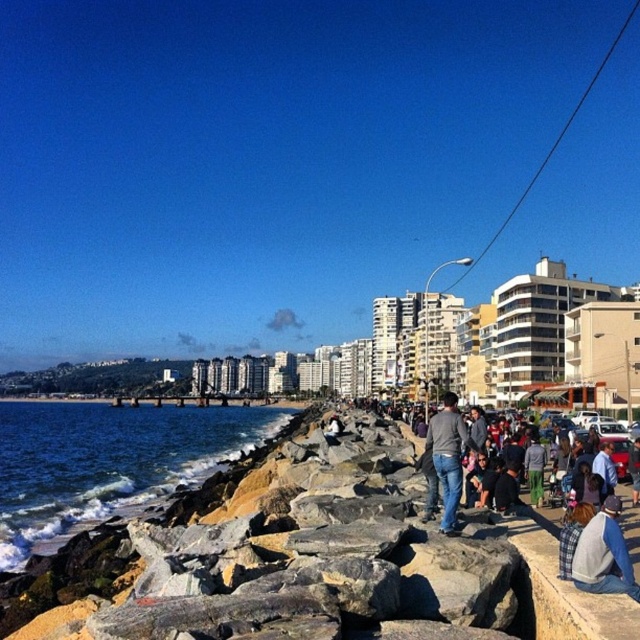
Where is `plaid fabric jacket at lower right`? The height and width of the screenshot is (640, 640). plaid fabric jacket at lower right is located at coordinates (604, 554).

In the scene shown: Is plaid fabric jacket at lower right positioned at the back of jeans at center?

No, it is not.

Does point (625, 576) lie in front of point (438, 468)?

Yes, it is.

Identify the location of plaid fabric jacket at lower right. This screenshot has height=640, width=640. (604, 554).

Does blue smooth water at lower left have a lesser height compared to jeans at center?

Incorrect, blue smooth water at lower left's height does not fall short of jeans at center's.

Between blue smooth water at lower left and jeans at center, which one appears on the left side from the viewer's perspective?

Positioned to the left is blue smooth water at lower left.

Does point (44, 452) come in front of point (458, 444)?

No.

You are a GUI agent. You are given a task and a screenshot of the screen. Output one action in this format:
    pyautogui.click(x=<x>, y=<y>)
    Task: Click on the blue smooth water at lower left
    The height and width of the screenshot is (640, 640).
    Given the screenshot: What is the action you would take?
    pyautogui.click(x=108, y=461)

Does blue smooth water at lower left have a larger size compared to denim jacket at lower right?

Correct, blue smooth water at lower left is larger in size than denim jacket at lower right.

Does point (44, 464) come closer to viewer compared to point (627, 464)?

No, it is behind (627, 464).

Find the location of a particular element. Image resolution: width=640 pixels, height=640 pixels. blue smooth water at lower left is located at coordinates (108, 461).

The image size is (640, 640). Find the location of `blue smooth water at lower left`. blue smooth water at lower left is located at coordinates (108, 461).